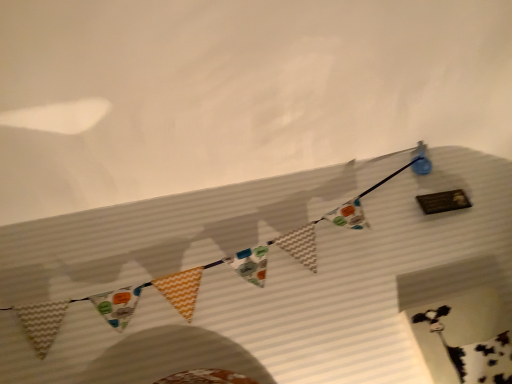
Find the location of a particular element. Image resolution: width=512 pixels, height=384 pixels. free space above printed fabric flags at center (from a real-world perspective) is located at coordinates (229, 179).